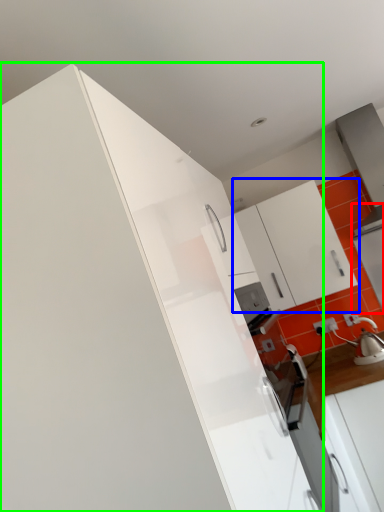
Question: Estimate the real-world distances between objects in this image. Which object is farther from appliance (highlighted by a red box), cabinetry (highlighted by a blue box) or cabinetry (highlighted by a green box)?

Choices:
 (A) cabinetry
 (B) cabinetry

Answer: (B)